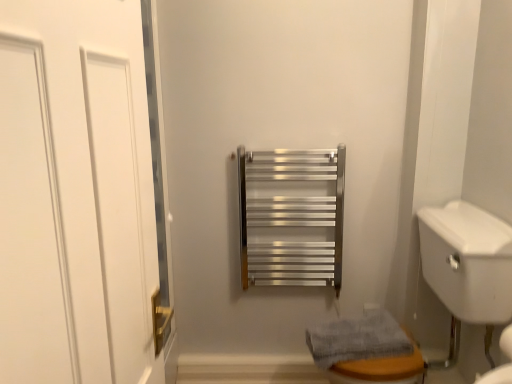
Question: Does white glossy sink at lower right appear on the right side of gray textured towel at lower right?

Choices:
 (A) no
 (B) yes

Answer: (B)

Question: Does white glossy sink at lower right turn towards gray textured towel at lower right?

Choices:
 (A) yes
 (B) no

Answer: (A)

Question: Is white glossy sink at lower right positioned with its back to gray textured towel at lower right?

Choices:
 (A) no
 (B) yes

Answer: (B)

Question: Is white glossy sink at lower right wider than gray textured towel at lower right?

Choices:
 (A) no
 (B) yes

Answer: (B)

Question: Is white glossy sink at lower right further to camera compared to gray textured towel at lower right?

Choices:
 (A) yes
 (B) no

Answer: (B)

Question: From the image's perspective, is white glossy sink at lower right above gray textured towel at lower right?

Choices:
 (A) yes
 (B) no

Answer: (A)

Question: From the image's perspective, does gray textured towel at lower right appear higher than white matte door at left?

Choices:
 (A) yes
 (B) no

Answer: (B)

Question: Is white matte door at left at the back of gray textured towel at lower right?

Choices:
 (A) yes
 (B) no

Answer: (B)

Question: Does gray textured towel at lower right lie in front of white matte door at left?

Choices:
 (A) no
 (B) yes

Answer: (A)

Question: Considering the relative sizes of gray textured towel at lower right and white matte door at left in the image provided, is gray textured towel at lower right taller than white matte door at left?

Choices:
 (A) yes
 (B) no

Answer: (B)

Question: Considering the relative positions of gray textured towel at lower right and white matte door at left in the image provided, is gray textured towel at lower right to the left of white matte door at left from the viewer's perspective?

Choices:
 (A) yes
 (B) no

Answer: (B)

Question: Does gray textured towel at lower right have a larger size compared to white matte door at left?

Choices:
 (A) no
 (B) yes

Answer: (B)

Question: Is white matte door at left further to camera compared to white glossy sink at lower right?

Choices:
 (A) yes
 (B) no

Answer: (B)